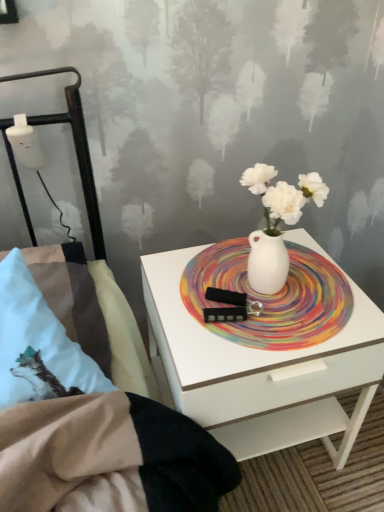
The width and height of the screenshot is (384, 512). I want to click on free space above white glossy nightstand at center (from a real-world perspective), so click(252, 293).